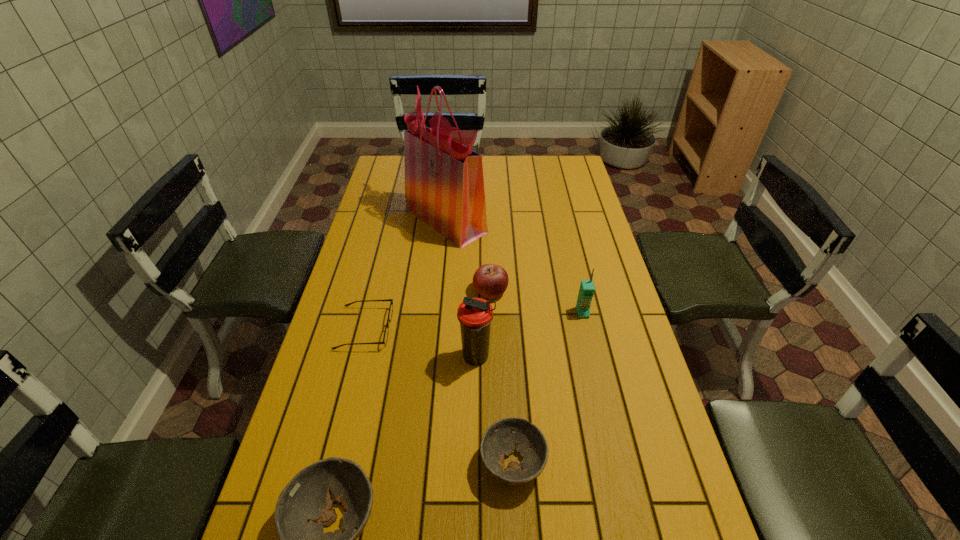
Image resolution: width=960 pixels, height=540 pixels. I want to click on free space at the right edge of the desktop, so click(x=646, y=415).

Locate an element on the screen. free space between the thermos bottle and the fifth shortest object is located at coordinates (530, 335).

Locate an element on the screen. free point between the tallest object and the cellular telephone is located at coordinates pyautogui.click(x=515, y=266).

Locate an element on the screen. The width and height of the screenshot is (960, 540). free space between the sixth shortest object and the spectacles is located at coordinates (420, 343).

At what (x,y) coordinates should I click in order to perform the action: click on empty space that is in between the right bowl and the second tallest object. Please return your answer as a coordinate pair (x, y). The width and height of the screenshot is (960, 540). Looking at the image, I should click on (494, 410).

Locate an element on the screen. The height and width of the screenshot is (540, 960). free space between the tallest object and the cellular telephone is located at coordinates (515, 266).

The width and height of the screenshot is (960, 540). I want to click on unoccupied position between the sixth tallest object and the second farthest object, so click(x=501, y=377).

What are the coordinates of `object that is the fifth nearest to the rightmost object` in the screenshot? It's located at (385, 337).

At what (x,y) coordinates should I click in order to perform the action: click on the third closest object to the second tallest object. Please return your answer as a coordinate pair (x, y). The image size is (960, 540). Looking at the image, I should click on (385, 337).

The image size is (960, 540). I want to click on free location that satisfies the following two spatial constraints: 1. on the keypad of the cellular telephone; 2. on the front-facing side of the shortest object, so click(x=586, y=328).